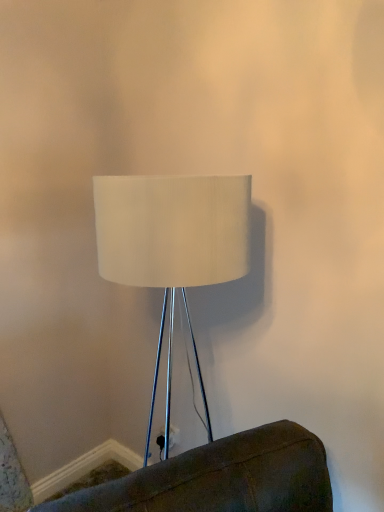
What do you see at coordinates (172, 245) in the screenshot? I see `white fabric lampshade at center` at bounding box center [172, 245].

The height and width of the screenshot is (512, 384). In order to click on white fabric lampshade at center in this screenshot , I will do 172,245.

In order to click on white fabric lampshade at center in this screenshot , I will do `click(172, 245)`.